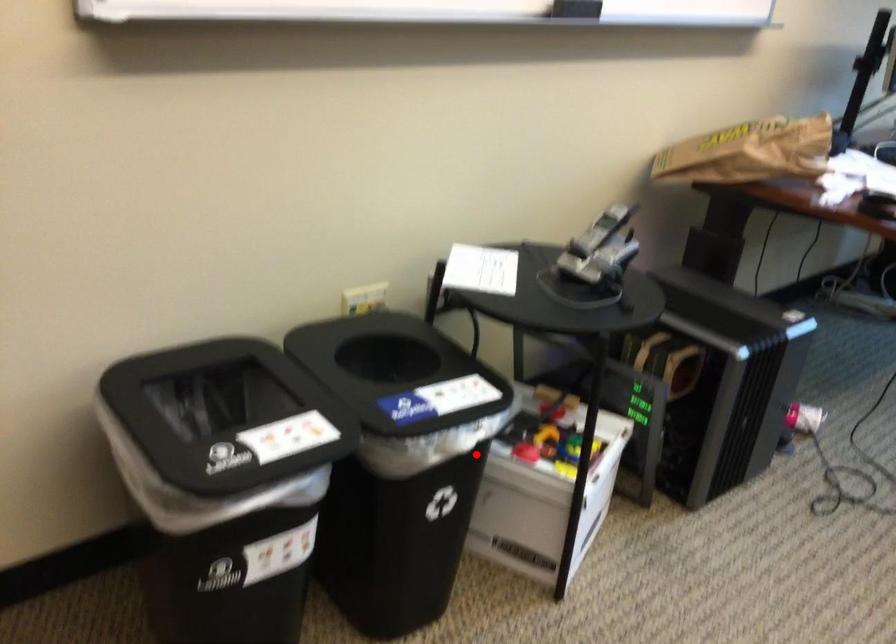
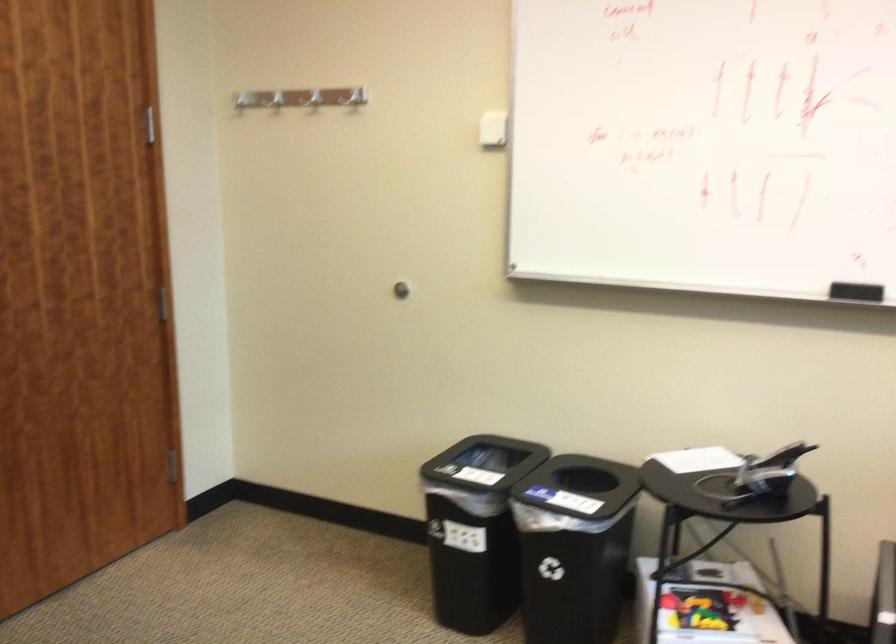
Question: I am providing you with two images of the same scene from different viewpoints. A red point is shown in image1. For the corresponding object point in image2, is it positioned nearer or farther from the camera?

Choices:
 (A) Nearer
 (B) Farther

Answer: (B)